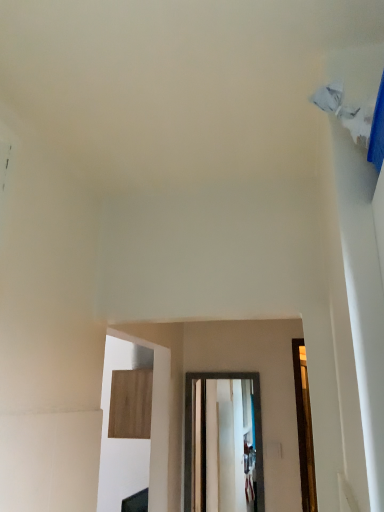
Question: Considering the positions of wooden panel at center and transparent glass door at center in the image, is wooden panel at center wider or thinner than transparent glass door at center?

Choices:
 (A) wide
 (B) thin

Answer: (A)

Question: Which is correct: wooden panel at center is inside transparent glass door at center, or outside of it?

Choices:
 (A) outside
 (B) inside

Answer: (A)

Question: Does point (144, 392) appear closer or farther from the camera than point (236, 373)?

Choices:
 (A) farther
 (B) closer

Answer: (A)

Question: Based on their sizes in the image, would you say transparent glass door at center is bigger or smaller than wooden panel at center?

Choices:
 (A) small
 (B) big

Answer: (A)

Question: Is transparent glass door at center to the left or to the right of wooden panel at center in the image?

Choices:
 (A) right
 (B) left

Answer: (A)

Question: Considering the positions of transparent glass door at center and wooden panel at center in the image, is transparent glass door at center wider or thinner than wooden panel at center?

Choices:
 (A) wide
 (B) thin

Answer: (B)

Question: Is transparent glass door at center taller or shorter than wooden panel at center?

Choices:
 (A) short
 (B) tall

Answer: (B)